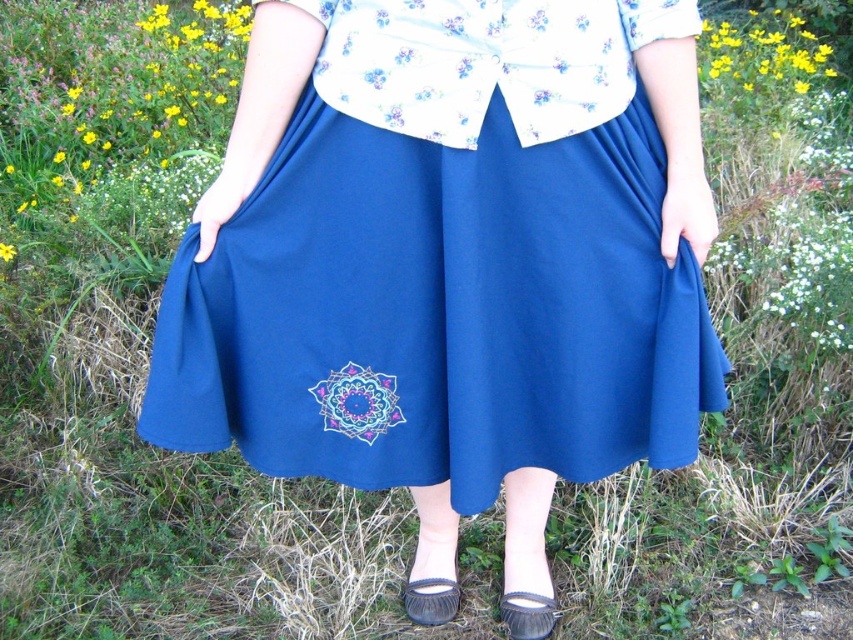
Between yellow/yellowish-green petals at upper right and leather moccasin at lower center, which one appears on the left side from the viewer's perspective?

leather moccasin at lower center

Can you confirm if yellow/yellowish-green petals at upper right is positioned to the left of leather moccasin at lower center?

In fact, yellow/yellowish-green petals at upper right is to the right of leather moccasin at lower center.

Is point (799, 29) farther from camera compared to point (434, 616)?

Yes, point (799, 29) is behind point (434, 616).

Where is `yellow/yellowish-green petals at upper right`? The height and width of the screenshot is (640, 853). yellow/yellowish-green petals at upper right is located at coordinates (764, 51).

Is matte floral blouse at upper center wider than matte gray sandal at lower center?

Correct, the width of matte floral blouse at upper center exceeds that of matte gray sandal at lower center.

Who is more distant from viewer, [567,35] or [547,602]?

The point [547,602] is more distant.

In order to click on matte floral blouse at upper center in this screenshot , I will do `click(486, 61)`.

Who is taller, matte blue skirt at center or leather moccasin at lower center?

Standing taller between the two is matte blue skirt at center.

Is point (317, 440) behind point (410, 600)?

No, (317, 440) is closer to viewer.

Is point (498, 291) closer to camera compared to point (456, 582)?

Yes.

Locate an element on the screen. matte blue skirt at center is located at coordinates (450, 259).